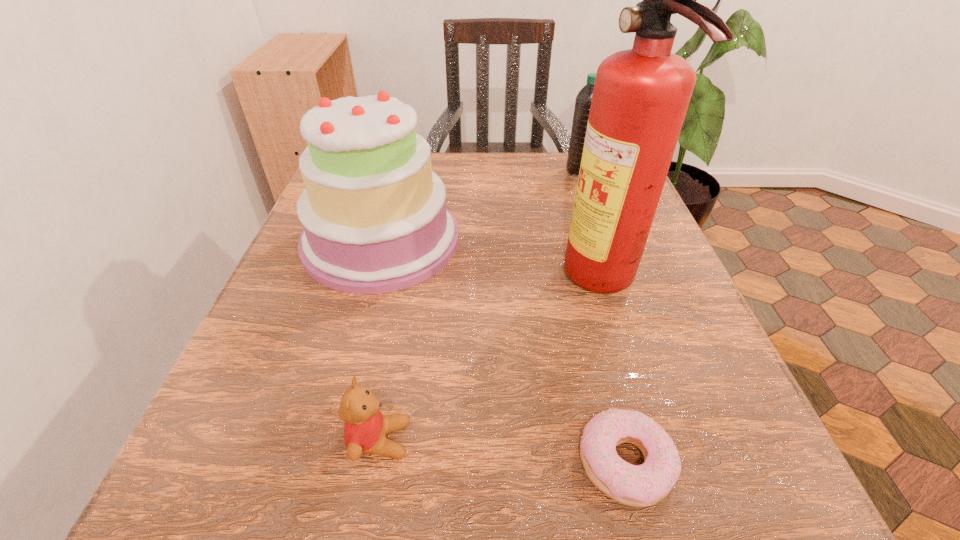
Image resolution: width=960 pixels, height=540 pixels. In order to click on vacant space that satisfies the following two spatial constraints: 1. on the front-facing side of the fire extinguisher; 2. on the front side of the doughnut in this screenshot , I will do `click(659, 463)`.

Where is `vacant space that satisfies the following two spatial constraints: 1. on the front-facing side of the tallest object; 2. on the front side of the doughnut`? Image resolution: width=960 pixels, height=540 pixels. vacant space that satisfies the following two spatial constraints: 1. on the front-facing side of the tallest object; 2. on the front side of the doughnut is located at coordinates (659, 463).

Where is `vacant position in the image that satisfies the following two spatial constraints: 1. on the front-facing side of the teddy bear; 2. on the right side of the shortest object`? This screenshot has width=960, height=540. vacant position in the image that satisfies the following two spatial constraints: 1. on the front-facing side of the teddy bear; 2. on the right side of the shortest object is located at coordinates (375, 463).

Locate an element on the screen. This screenshot has height=540, width=960. free spot that satisfies the following two spatial constraints: 1. on the back side of the cake; 2. on the left side of the third shortest object is located at coordinates (400, 171).